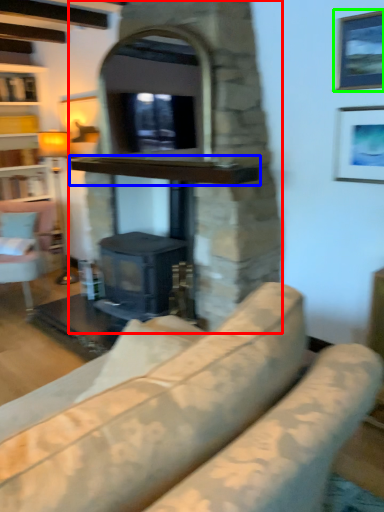
Question: Which object is the farthest from fireplace (highlighted by a red box)? Choose among these: mantle (highlighted by a blue box) or picture frame (highlighted by a green box).

Choices:
 (A) mantle
 (B) picture frame

Answer: (B)